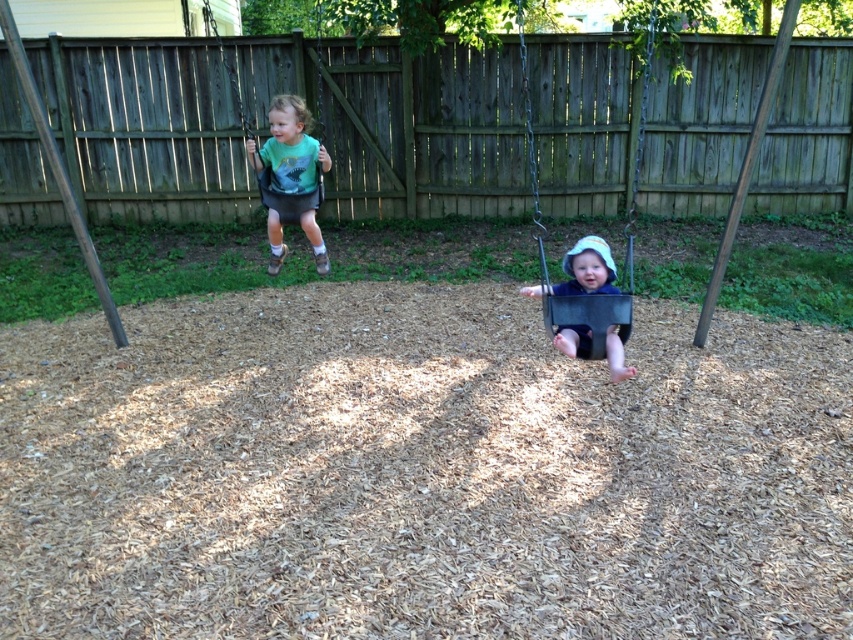
You are a photographer trying to capture a photo of the metallic gray swing at center without the brown wood pole at left appearing in the background. Based on their positions, can you position yourself in a way to achieve this?

Yes, since the metallic gray swing at center is in front of the brown wood pole at left, you can position yourself so that the swing blocks the view of the pole, ensuring it doesn not appear in the background.